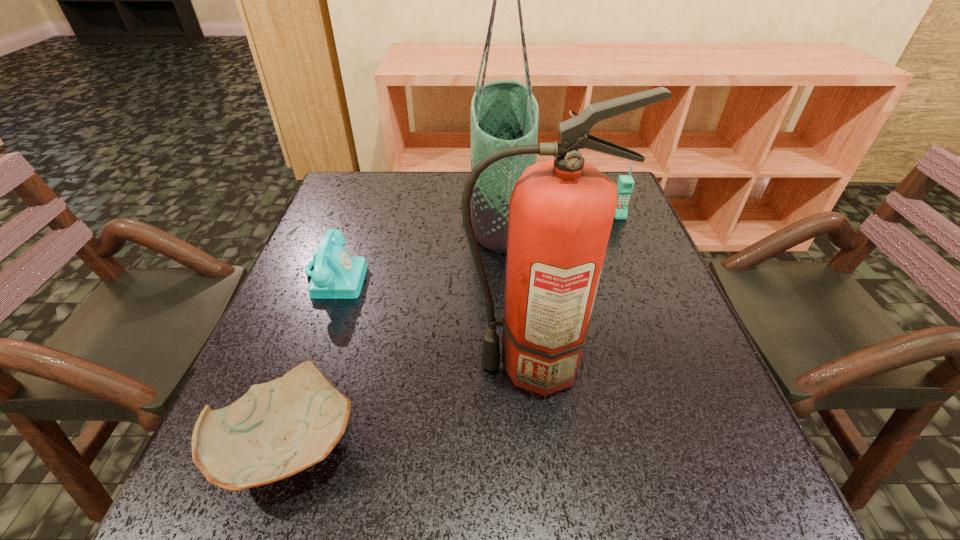
The height and width of the screenshot is (540, 960). Find the location of `tote bag`. tote bag is located at coordinates (504, 113).

Locate an element on the screen. The height and width of the screenshot is (540, 960). fire extinguisher is located at coordinates (561, 211).

Locate an element on the screen. Image resolution: width=960 pixels, height=540 pixels. the third shortest object is located at coordinates (625, 184).

This screenshot has height=540, width=960. I want to click on cellular telephone, so click(x=625, y=184).

The width and height of the screenshot is (960, 540). What are the coordinates of `telephone` in the screenshot? It's located at (336, 275).

Locate an element on the screen. This screenshot has height=540, width=960. pottery is located at coordinates (277, 429).

Locate an element on the screen. This screenshot has height=540, width=960. vacant space situated 0.090m on the left of the tote bag is located at coordinates (438, 213).

Identify the location of free space located on the nozzle of the fire extinguisher. This screenshot has width=960, height=540. (294, 365).

Where is `vacant space located 0.190m on the nozzle of the fire extinguisher`? The width and height of the screenshot is (960, 540). vacant space located 0.190m on the nozzle of the fire extinguisher is located at coordinates (364, 365).

The image size is (960, 540). I want to click on free space located 0.280m on the nozzle of the fire extinguisher, so click(316, 365).